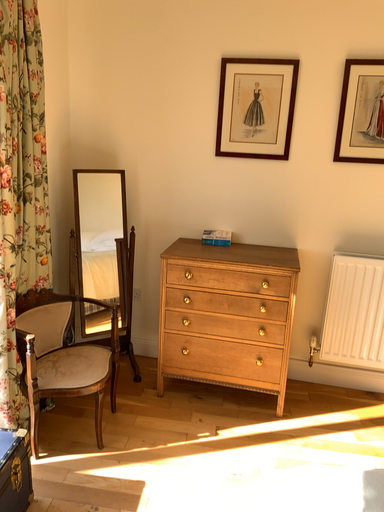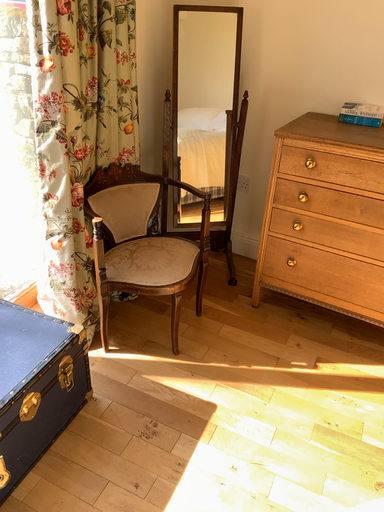
Question: Which way did the camera rotate in the video?

Choices:
 (A) rotated left
 (B) rotated right

Answer: (A)